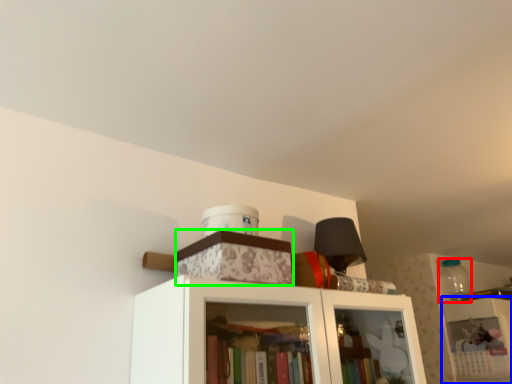
Question: Considering the real-world distances, which object is farthest from bottle (highlighted by a red box)? shelf (highlighted by a blue box) or cabinetry (highlighted by a green box)?

Choices:
 (A) shelf
 (B) cabinetry

Answer: (B)